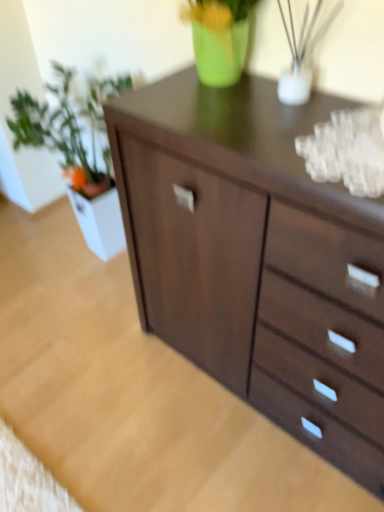
Question: Considering the positions of green matte plant at left and dark wood chest of drawers at center in the image, is green matte plant at left taller or shorter than dark wood chest of drawers at center?

Choices:
 (A) tall
 (B) short

Answer: (A)

Question: From a real-world perspective, is green matte plant at left physically located above or below dark wood chest of drawers at center?

Choices:
 (A) below
 (B) above

Answer: (B)

Question: In the image, is green matte plant at left positioned in front of or behind dark wood chest of drawers at center?

Choices:
 (A) behind
 (B) front

Answer: (A)

Question: From their relative heights in the image, would you say dark wood chest of drawers at center is taller or shorter than green matte plant at left?

Choices:
 (A) tall
 (B) short

Answer: (B)

Question: From the image's perspective, is dark wood chest of drawers at center located above or below green matte plant at left?

Choices:
 (A) above
 (B) below

Answer: (B)

Question: Visually, is dark wood chest of drawers at center positioned to the left or to the right of green matte plant at left?

Choices:
 (A) left
 (B) right

Answer: (B)

Question: Considering the positions of point (175, 140) and point (77, 151), is point (175, 140) closer or farther from the camera than point (77, 151)?

Choices:
 (A) farther
 (B) closer

Answer: (B)